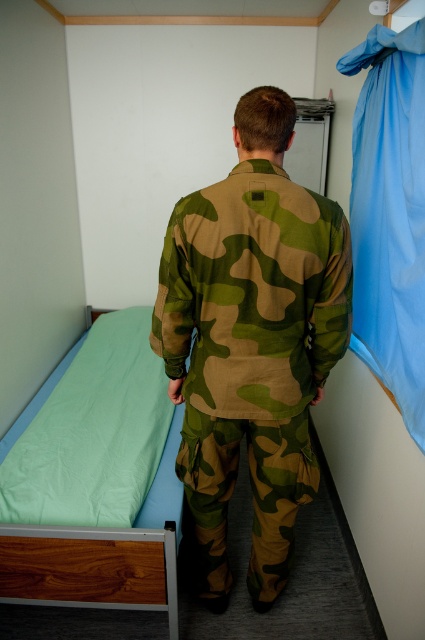
Can you confirm if camouflage fabric uniform at center is smaller than light blue fabric at upper right?

Incorrect, camouflage fabric uniform at center is not smaller in size than light blue fabric at upper right.

Is camouflage fabric uniform at center positioned at the back of light blue fabric at upper right?

That is False.

Who is more forward, (331, 275) or (419, 262)?

Point (331, 275) is more forward.

Find the location of a particular element. This screenshot has height=640, width=425. camouflage fabric uniform at center is located at coordinates (252, 340).

Does camouflage fabric uniform at center appear over green fabric bed at left?

Yes.

Is camouflage fabric uniform at center smaller than green fabric bed at left?

Yes.

What do you see at coordinates (252, 340) in the screenshot? I see `camouflage fabric uniform at center` at bounding box center [252, 340].

Locate an element on the screen. This screenshot has height=640, width=425. camouflage fabric uniform at center is located at coordinates (252, 340).

Does light blue fabric at upper right have a larger size compared to green fabric bed at left?

Incorrect, light blue fabric at upper right is not larger than green fabric bed at left.

Does light blue fabric at upper right have a lesser height compared to green fabric bed at left?

No.

Where is `light blue fabric at upper right`? light blue fabric at upper right is located at coordinates (390, 214).